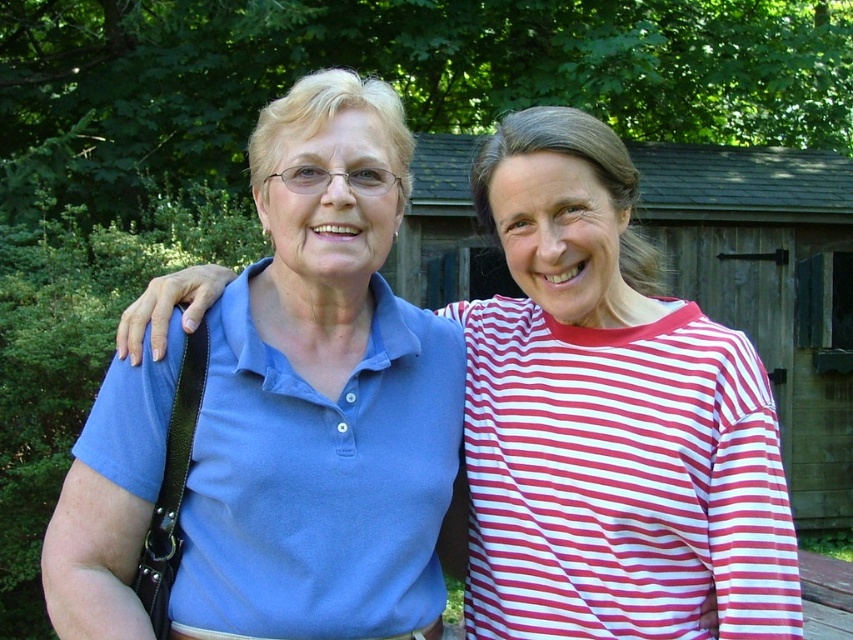
Question: Which object is the farthest from the matte blue polo shirt at center?

Choices:
 (A) blue cotton polo shirt at center
 (B) red striped shirt at right

Answer: (A)

Question: Can you confirm if blue cotton polo shirt at center is bigger than matte blue polo shirt at center?

Choices:
 (A) yes
 (B) no

Answer: (A)

Question: Is the position of blue cotton polo shirt at center less distant than that of red striped shirt at right?

Choices:
 (A) yes
 (B) no

Answer: (A)

Question: Which is nearer to the blue cotton polo shirt at center?

Choices:
 (A) red striped shirt at right
 (B) matte blue polo shirt at center

Answer: (A)

Question: From the image, what is the correct spatial relationship of red striped shirt at right in relation to matte blue polo shirt at center?

Choices:
 (A) above
 (B) below

Answer: (B)

Question: Which point is closer to the camera taking this photo?

Choices:
 (A) (700, 340)
 (B) (280, 454)

Answer: (B)